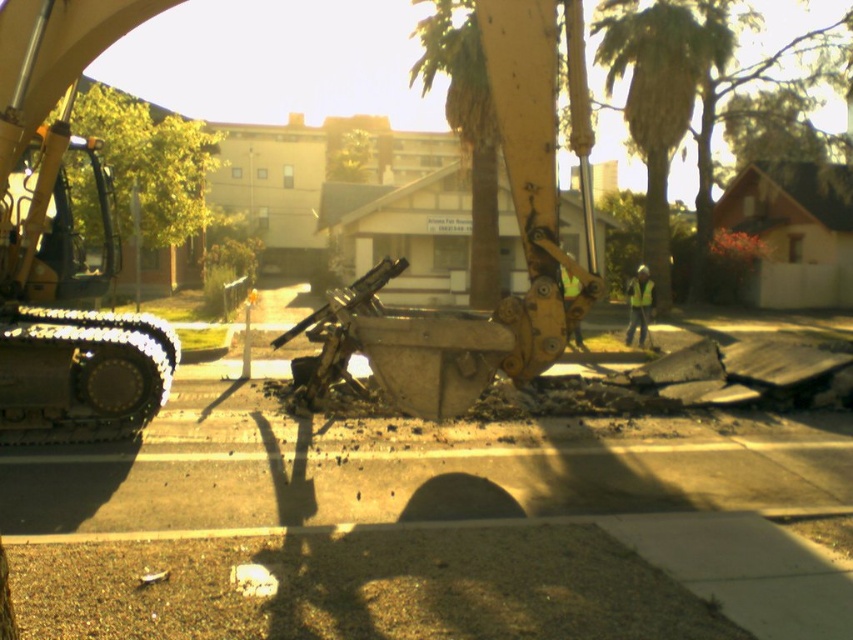
You are standing at the point with coordinates point (340, 289) and want to move to the point with coordinates point (4, 348). Is the point you want to reach in front of you?

Yes, the point (4, 348) is in front of point (340, 289), so the destination is in front of your current position.

You are a construction worker assessing the site. You see the yellow metallic excavator at center and the green leafy palm tree at upper center. Which object takes up more space in the image?

The yellow metallic excavator at center is bigger than the green leafy palm tree at upper center, so it takes up more space in the image.

You are a construction worker assessing the site. You see the yellow metallic excavator at center and the green leafy palm tree at upper center. Which object is taller?

The green leafy palm tree at upper center is taller than the yellow metallic excavator at center.